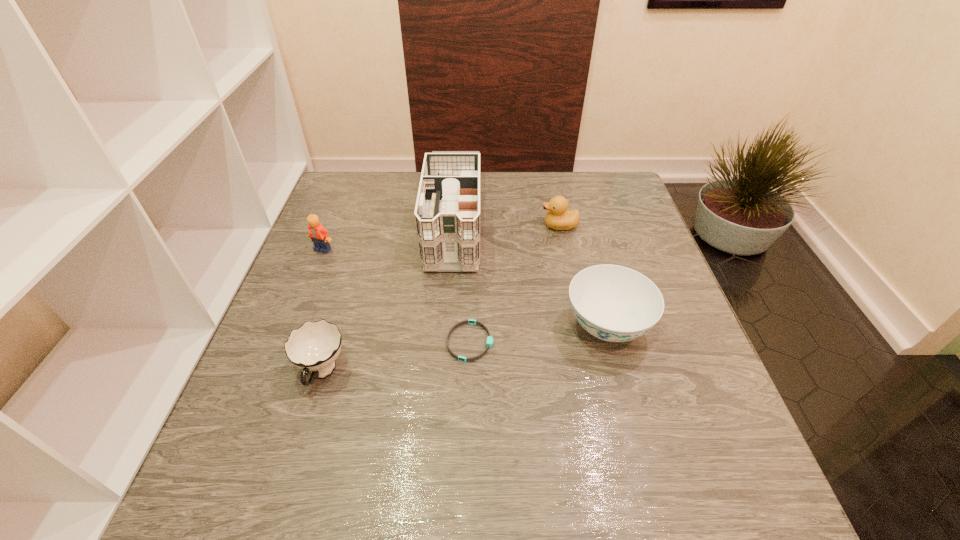
Locate an element on the screen. The height and width of the screenshot is (540, 960). free region at the left edge of the desktop is located at coordinates (338, 276).

In the image, there is a desktop. Identify the location of free region at the right edge. (680, 306).

You are a GUI agent. You are given a task and a screenshot of the screen. Output one action in this format:
    pyautogui.click(x=<x>, y=<y>)
    Task: Click on the vacant space at the far left corner of the desktop
    This screenshot has height=540, width=960.
    Given the screenshot: What is the action you would take?
    pyautogui.click(x=334, y=180)

Locate an element on the screen. This screenshot has width=960, height=540. blank space at the near left corner of the desktop is located at coordinates (286, 481).

The width and height of the screenshot is (960, 540). Identify the location of vacant space at the near right corner of the desktop. (701, 518).

Where is `empty space between the tallest object and the fifth object from right to left`? empty space between the tallest object and the fifth object from right to left is located at coordinates (388, 295).

The height and width of the screenshot is (540, 960). I want to click on unoccupied area between the shortest object and the duckling, so [515, 284].

In order to click on unoccupied position between the leftmost object and the cup in this screenshot , I will do `click(323, 311)`.

The image size is (960, 540). I want to click on vacant space in between the dollhouse and the wristband, so click(462, 280).

At what (x,y) coordinates should I click in order to perform the action: click on free area in between the cup and the dollhouse. Please return your answer as a coordinate pair (x, y). The height and width of the screenshot is (540, 960). Looking at the image, I should click on (388, 295).